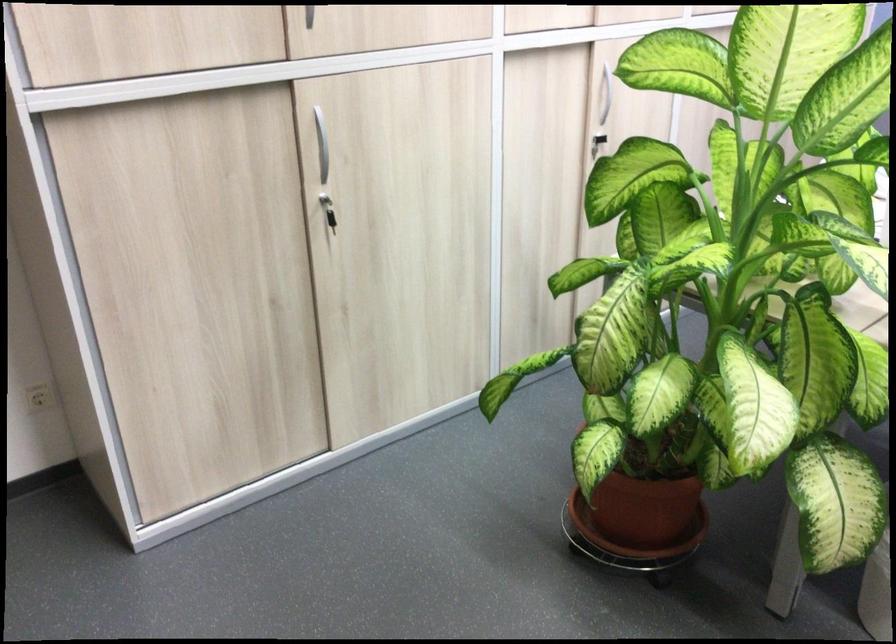
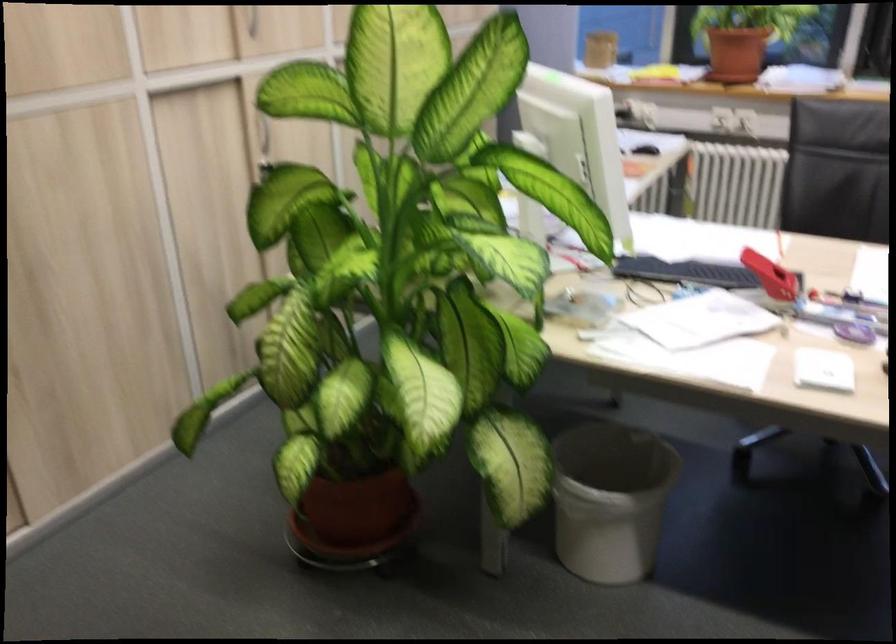
Question: Based on the continuous images, in which direction is the camera rotating? Reply with the corresponding letter.

Choices:
 (A) Left
 (B) Right
 (C) Up
 (D) Down

Answer: (B)